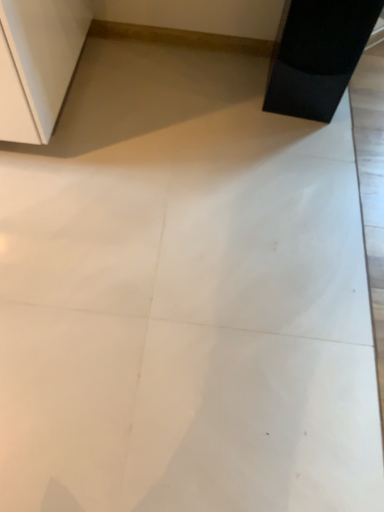
Where is `vacant space that is to the left of glossy black speaker at upper right`? vacant space that is to the left of glossy black speaker at upper right is located at coordinates (232, 86).